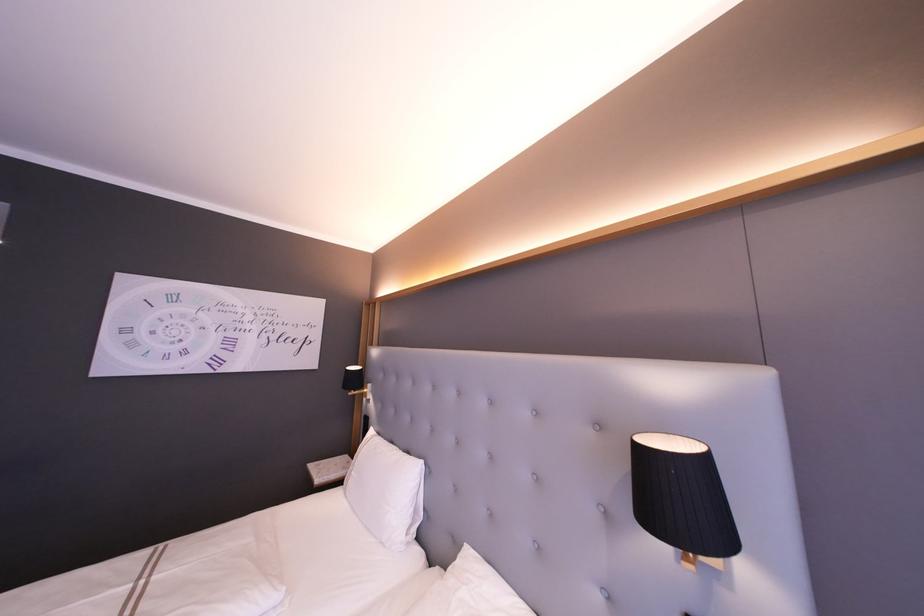
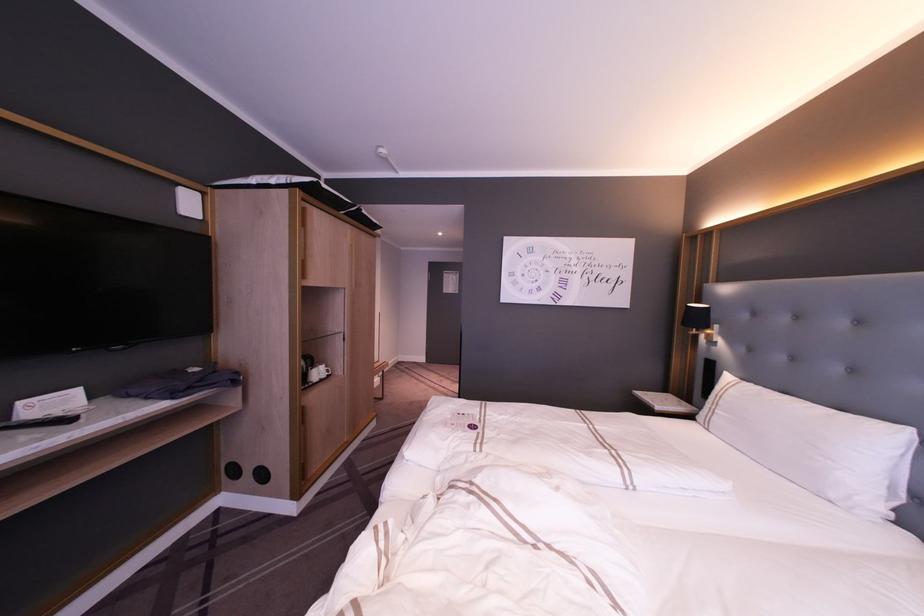
In the second image, find the point that corresponds to the point at 421,461 in the first image.

(910, 429)